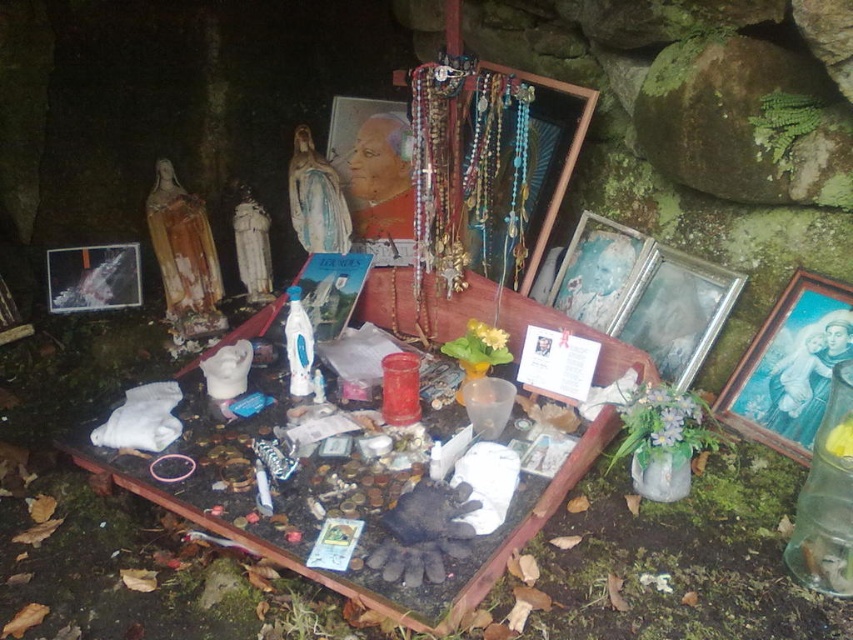
Is point (732, 410) closer to viewer compared to point (350, 131)?

Yes, it is.

Is wooden painted picture frame at right further to camera compared to matte wooden picture frame at center?

No, wooden painted picture frame at right is in front of matte wooden picture frame at center.

Which is in front, point (769, 337) or point (372, 221)?

Point (769, 337) is in front.

Locate an element on the screen. wooden painted picture frame at right is located at coordinates (790, 365).

Between wooden picture frame at center and metallic silver photo frame at left, which one appears on the right side from the viewer's perspective?

wooden picture frame at center

Can you confirm if wooden picture frame at center is positioned above metallic silver photo frame at left?

Indeed, wooden picture frame at center is positioned over metallic silver photo frame at left.

Is point (592, 273) positioned after point (78, 273)?

No, it is in front of (78, 273).

I want to click on wooden picture frame at center, so click(596, 269).

Who is taller, metallic silver picture frame at right or wooden picture frame at center?

metallic silver picture frame at right

Is metallic silver picture frame at right thinner than wooden picture frame at center?

No, metallic silver picture frame at right is not thinner than wooden picture frame at center.

Does point (701, 275) come in front of point (579, 232)?

Yes.

Locate an element on the screen. metallic silver picture frame at right is located at coordinates (676, 310).